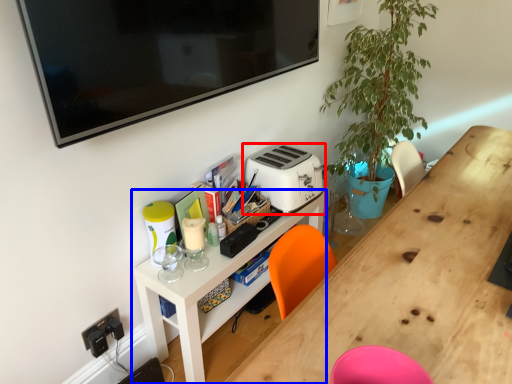
Question: Which object is closer to the camera taking this photo, toaster (highlighted by a red box) or shelf (highlighted by a blue box)?

Choices:
 (A) toaster
 (B) shelf

Answer: (B)